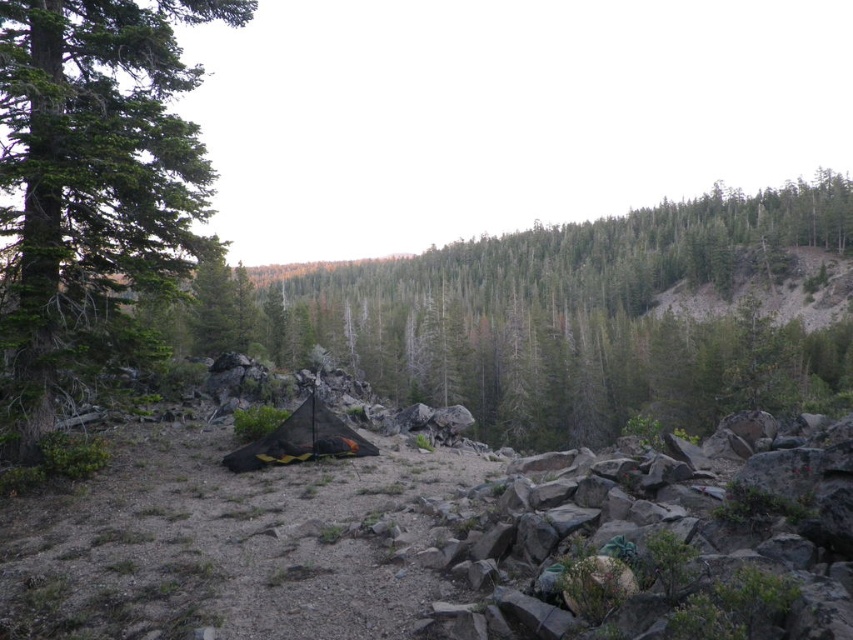
You are setting up a tent in a forest and want to ensure it won t be hit by falling branches. Given that you have a black mesh tent at center and a green textured tree at left, which object is taller and poses a higher risk of falling branches?

The green textured tree at left is taller than the black mesh tent at center, so it poses a higher risk of falling branches.

You are a hiker who has just arrived at the campsite. You see the green matte tent at center and the green textured tree at left. Which object is positioned higher in the image?

The green matte tent at center is located above the green textured tree at left, so it is positioned higher in the image.